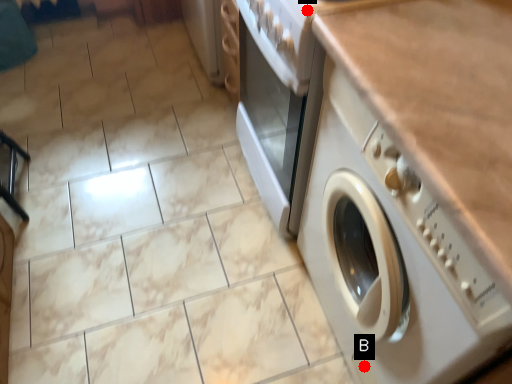
Question: Two points are circled on the image, labeled by A and B beside each circle. Which of the following is the closest to the observer?

Choices:
 (A) A is closer
 (B) B is closer

Answer: (A)